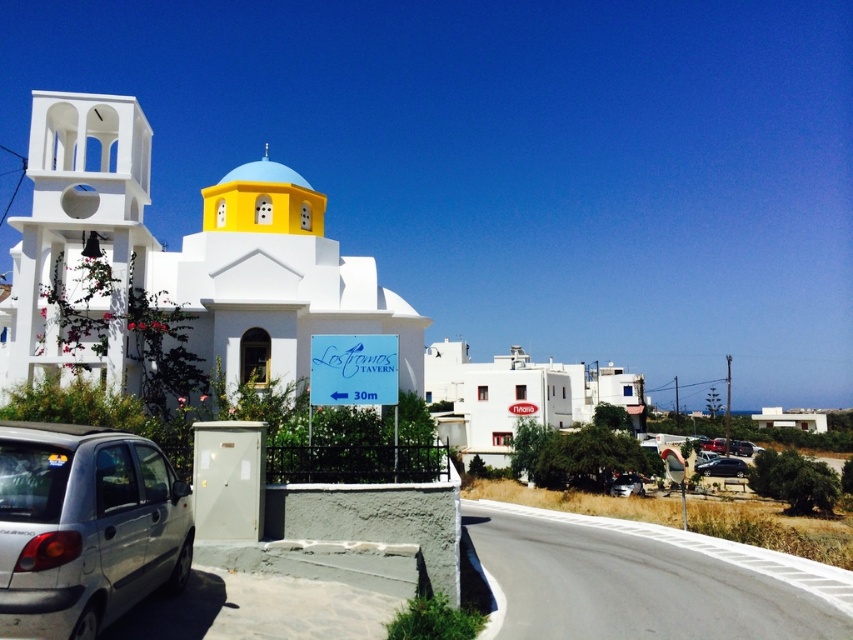
Is white matte church at left positioned behind metallic silver car at lower right?

That is False.

Image resolution: width=853 pixels, height=640 pixels. I want to click on white matte church at left, so 177,268.

Which is below, silver metallic car at lower left or metallic silver car at lower right?

metallic silver car at lower right is below.

Can you confirm if silver metallic car at lower left is positioned to the left of metallic silver car at lower right?

Yes, silver metallic car at lower left is to the left of metallic silver car at lower right.

This screenshot has height=640, width=853. Identify the location of silver metallic car at lower left. [85, 528].

Is shiny black sedan at lower right to the left of metallic silver car at lower right from the viewer's perspective?

No, shiny black sedan at lower right is not to the left of metallic silver car at lower right.

Does point (744, 476) come in front of point (614, 481)?

No, (744, 476) is behind (614, 481).

Who is more forward, (x=718, y=465) or (x=637, y=476)?

Point (x=637, y=476) is in front.

Where is `shiny black sedan at lower right`? Image resolution: width=853 pixels, height=640 pixels. shiny black sedan at lower right is located at coordinates (722, 467).